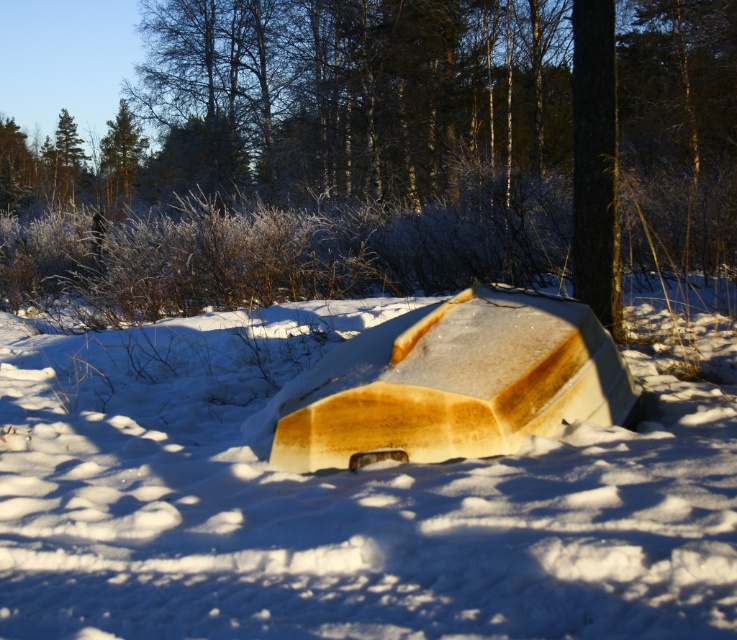
Does point (265, 360) lie in front of point (485, 396)?

No, (265, 360) is behind (485, 396).

Does point (147, 570) lie behind point (368, 390)?

No, (147, 570) is in front of (368, 390).

Image resolution: width=737 pixels, height=640 pixels. What are the coordinates of `white matte boat at center` in the screenshot? It's located at (349, 496).

Who is taller, white matte boat at center or green matte tree at upper left?

green matte tree at upper left is taller.

Measure the distance from white matte boat at center to green matte tree at upper left.

They are 32.90 meters apart.

Locate an element on the screen. This screenshot has height=640, width=737. white matte boat at center is located at coordinates (349, 496).

Does wooden canoe at center have a greater width compared to green matte tree at upper left?

Correct, the width of wooden canoe at center exceeds that of green matte tree at upper left.

Image resolution: width=737 pixels, height=640 pixels. What do you see at coordinates (454, 381) in the screenshot? I see `wooden canoe at center` at bounding box center [454, 381].

What do you see at coordinates (454, 381) in the screenshot? I see `wooden canoe at center` at bounding box center [454, 381].

Locate an element on the screen. wooden canoe at center is located at coordinates (454, 381).